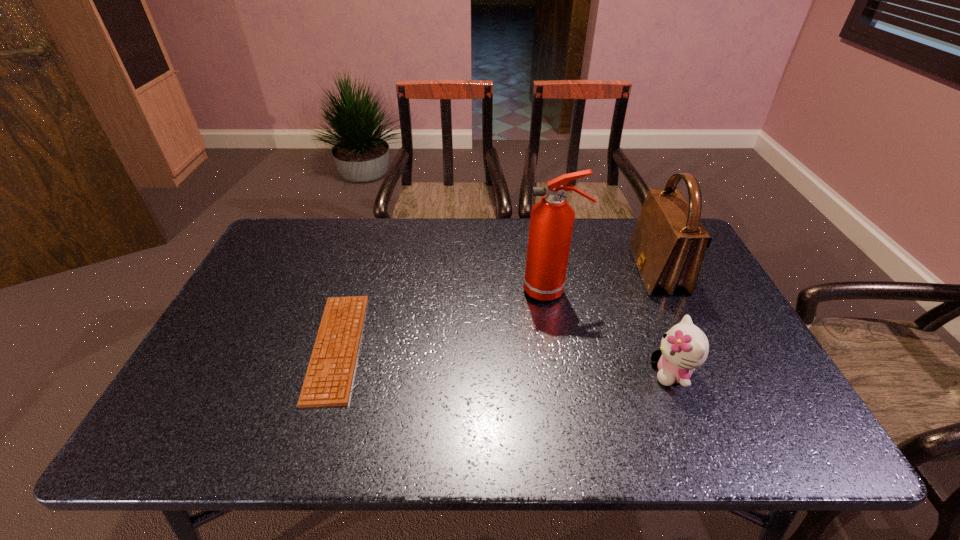
Locate an element on the screen. The image size is (960, 540). free area in between the tallest object and the shoulder bag is located at coordinates (604, 281).

In order to click on free area in between the third shortest object and the second shortest object in this screenshot , I will do `click(664, 322)`.

Where is `free space between the second shortest object and the shortest object`? free space between the second shortest object and the shortest object is located at coordinates (505, 360).

Point out which object is positioned as the second nearest to the tallest object. Please provide its 2D coordinates. Your answer should be formatted as a tuple, i.e. [(x, y)], where the tuple contains the x and y coordinates of a point satisfying the conditions above.

[(684, 347)]

Identify which object is the closest to the computer keyboard. Please provide its 2D coordinates. Your answer should be formatted as a tuple, i.e. [(x, y)], where the tuple contains the x and y coordinates of a point satisfying the conditions above.

[(551, 222)]